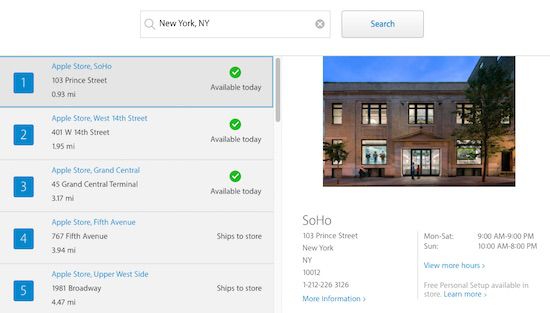
Where is `two glass doors`? two glass doors is located at coordinates (426, 159), (417, 155).